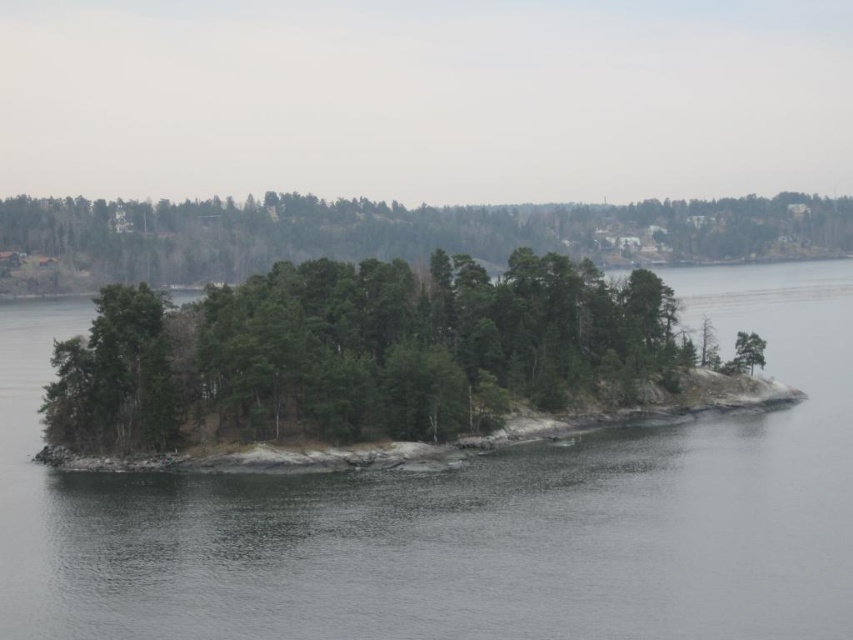
Question: Which of the following is the farthest from the observer?

Choices:
 (A) green matte trees at upper center
 (B) gray water at center
 (C) green matte tree at left
 (D) green textured island at center

Answer: (A)

Question: Which object appears farthest from the camera in this image?

Choices:
 (A) green matte tree at left
 (B) green textured island at center
 (C) gray water at center

Answer: (A)

Question: Can you confirm if green textured island at center is positioned to the left of green matte trees at upper center?

Choices:
 (A) yes
 (B) no

Answer: (A)

Question: Which of the following is the closest to the observer?

Choices:
 (A) (660, 292)
 (B) (102, 316)
 (C) (50, 496)
 (D) (422, 237)

Answer: (C)

Question: Is the position of green matte trees at upper center more distant than that of green matte tree at left?

Choices:
 (A) yes
 (B) no

Answer: (A)

Question: Is gray water at center below green matte tree at left?

Choices:
 (A) no
 (B) yes

Answer: (A)